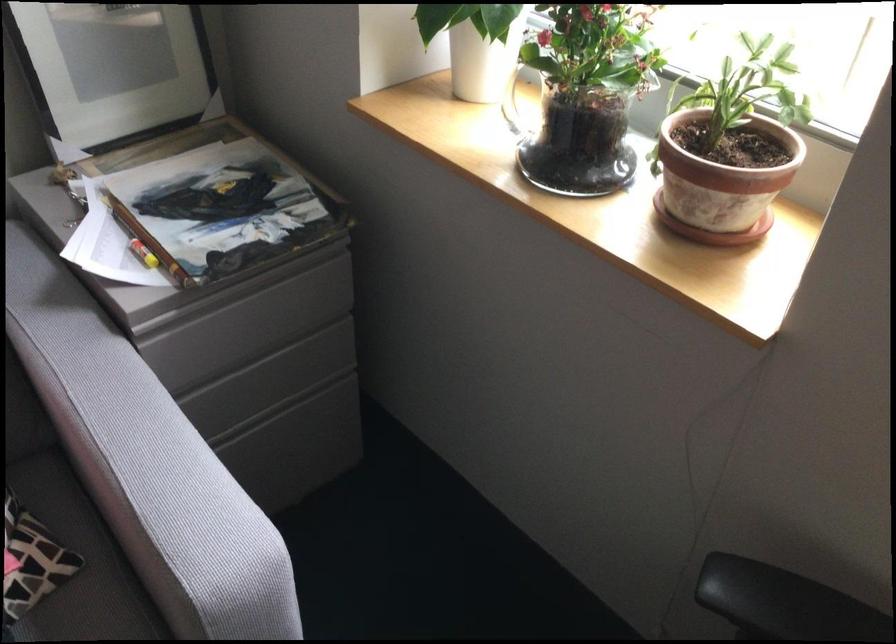
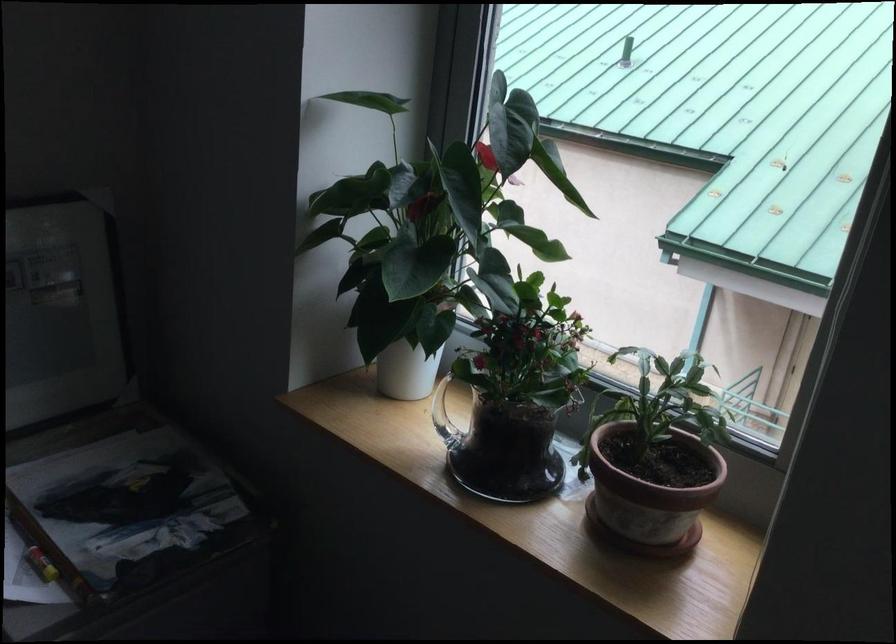
Where in the second image is the point corresponding to the point at 717,174 from the first image?

(650, 493)